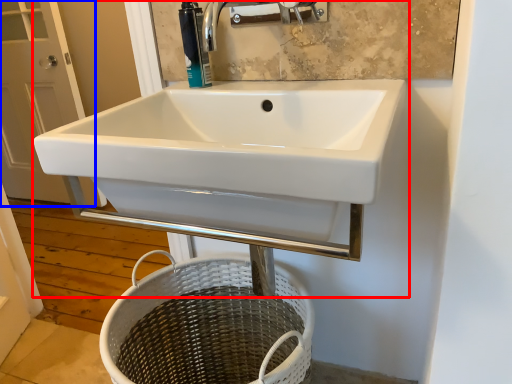
Question: Which object appears farthest to the camera in this image, sink (highlighted by a red box) or screen door (highlighted by a blue box)?

Choices:
 (A) sink
 (B) screen door

Answer: (B)